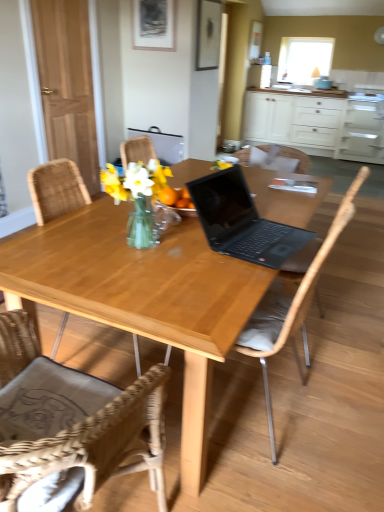
You are a GUI agent. You are given a task and a screenshot of the screen. Output one action in this format:
    pyautogui.click(x=<x>, y=<y>)
    Task: Click on the vacant area located to the right-hand side of translucent glass vase at center
    The height and width of the screenshot is (512, 384).
    Given the screenshot: What is the action you would take?
    pyautogui.click(x=195, y=250)